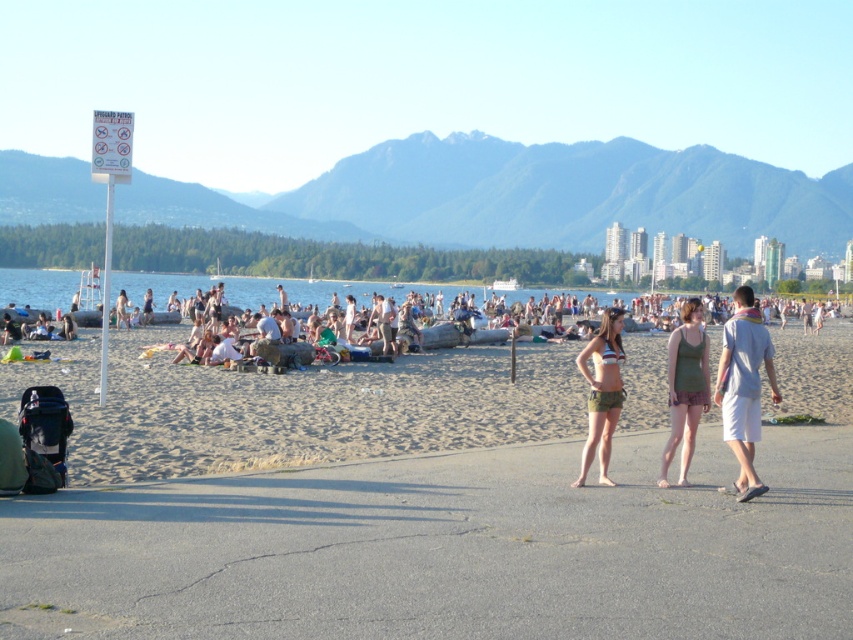
Question: Considering the relative positions of green fabric bikini bottom at center and black fabric baby carriage at lower left in the image provided, where is green fabric bikini bottom at center located with respect to black fabric baby carriage at lower left?

Choices:
 (A) above
 (B) below

Answer: (A)

Question: Which point appears farthest from the camera in this image?

Choices:
 (A) (51, 419)
 (B) (740, 433)

Answer: (B)

Question: Considering the real-world distances, which object is farthest from the black fabric baby carriage at lower left?

Choices:
 (A) light blue cotton shirt at center
 (B) green fabric bikini bottom at center

Answer: (A)

Question: Can you confirm if sandy beach at center is positioned above striped bikini top at center?

Choices:
 (A) yes
 (B) no

Answer: (B)

Question: Considering the relative positions of sandy beach at center and black fabric baby carriage at lower left in the image provided, where is sandy beach at center located with respect to black fabric baby carriage at lower left?

Choices:
 (A) above
 (B) below

Answer: (A)

Question: Which object is closer to the camera taking this photo?

Choices:
 (A) light blue cotton shirt at center
 (B) striped bikini top at center
 (C) green fabric bikini bottom at center
 (D) sandy beach at center

Answer: (C)